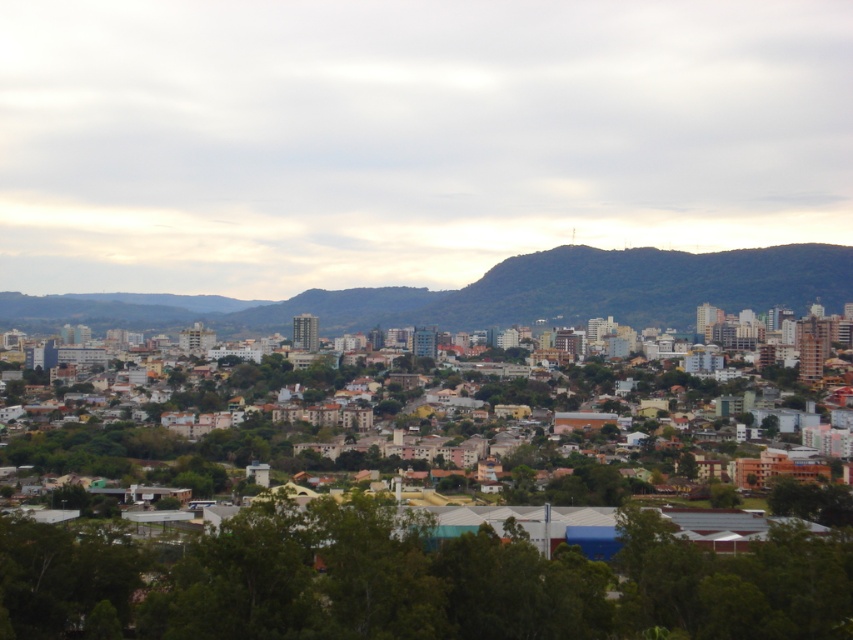
Is green leafy tree at lower center shorter than green forested mountain at center?

No.

Is green leafy tree at lower center thinner than green forested mountain at center?

Correct, green leafy tree at lower center's width is less than green forested mountain at center's.

The image size is (853, 640). I want to click on green leafy tree at lower center, so click(415, 582).